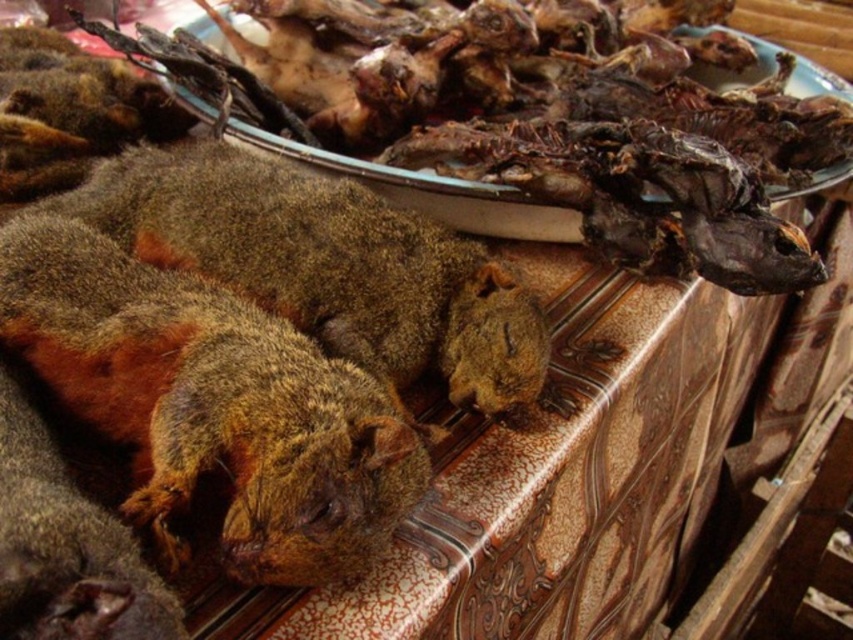
Question: From the image, what is the correct spatial relationship of brown fuzzy squirrel at lower left in relation to brown fuzzy squirrel at center?

Choices:
 (A) above
 (B) below

Answer: (B)

Question: Can you confirm if brown fuzzy squirrel at lower left is positioned below brown fuzzy squirrel at center?

Choices:
 (A) yes
 (B) no

Answer: (A)

Question: Which object is closer to the camera taking this photo?

Choices:
 (A) brown fuzzy squirrel at center
 (B) brown fuzzy squirrel at lower left

Answer: (B)

Question: Which of the following is the closest to the observer?

Choices:
 (A) brown fuzzy squirrel at lower left
 (B) brown fuzzy squirrel at center

Answer: (A)

Question: In this image, where is brown fuzzy squirrel at lower left located relative to brown fuzzy squirrel at center?

Choices:
 (A) right
 (B) left

Answer: (B)